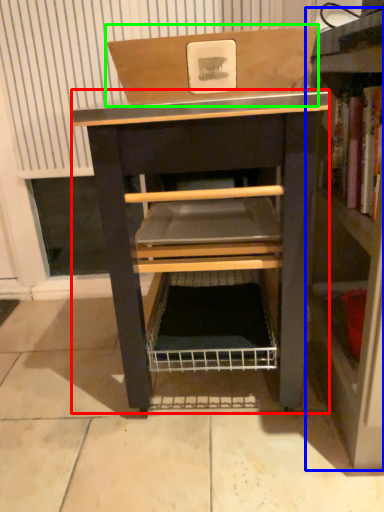
Question: Considering the real-world distances, which object is farthest from vanity (highlighted by a red box)? shelf (highlighted by a blue box) or cardboard box (highlighted by a green box)?

Choices:
 (A) shelf
 (B) cardboard box

Answer: (A)